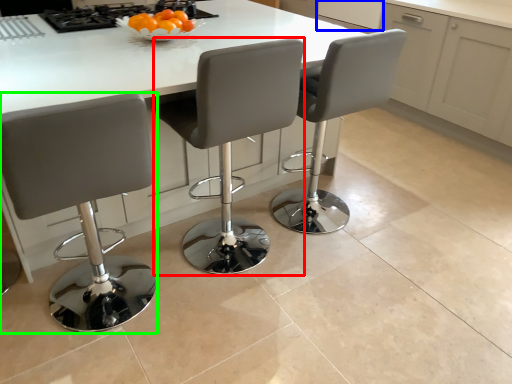
Question: Based on their relative distances, which object is nearer to chair (highlighted by a red box)? Choose from cabinetry (highlighted by a blue box) and chair (highlighted by a green box).

Choices:
 (A) cabinetry
 (B) chair

Answer: (B)